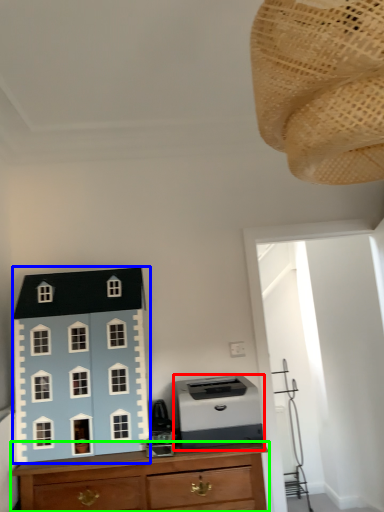
Question: Considering the real-world distances, which object is closest to printer (highlighted by a red box)? toy (highlighted by a blue box) or chest of drawers (highlighted by a green box).

Choices:
 (A) toy
 (B) chest of drawers

Answer: (B)